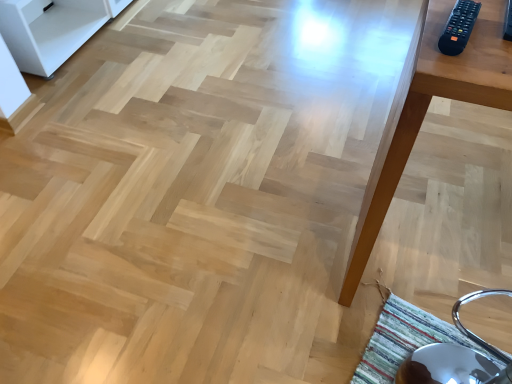
Locate an element on the screen. light brown wood table at right is located at coordinates (426, 111).

The height and width of the screenshot is (384, 512). What do you see at coordinates (426, 111) in the screenshot?
I see `light brown wood table at right` at bounding box center [426, 111].

From the picture: In order to face light brown wood table at right, should I rotate leftwards or rightwards?

It's best to rotate right around 27.902 degrees.

Locate an element on the screen. The image size is (512, 384). light brown wood table at right is located at coordinates (426, 111).